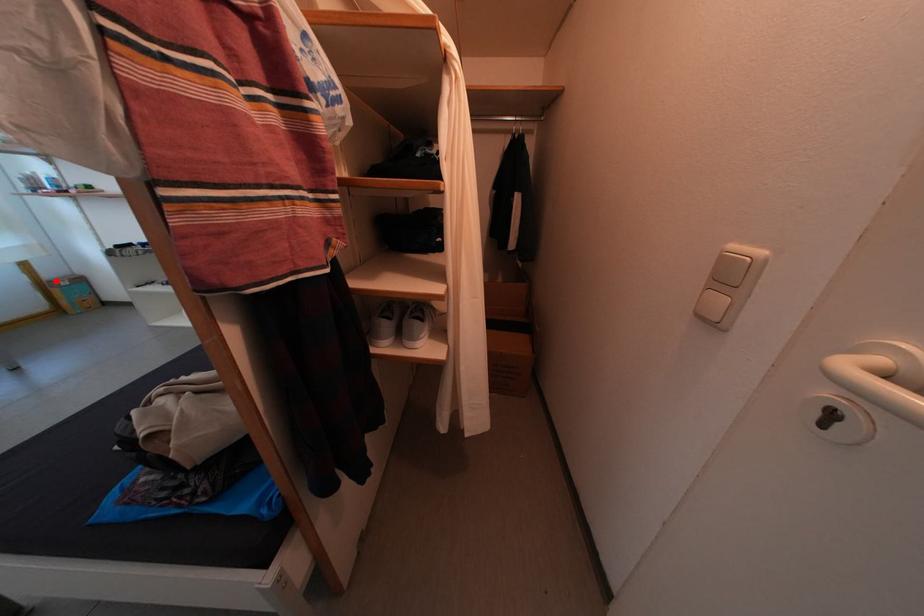
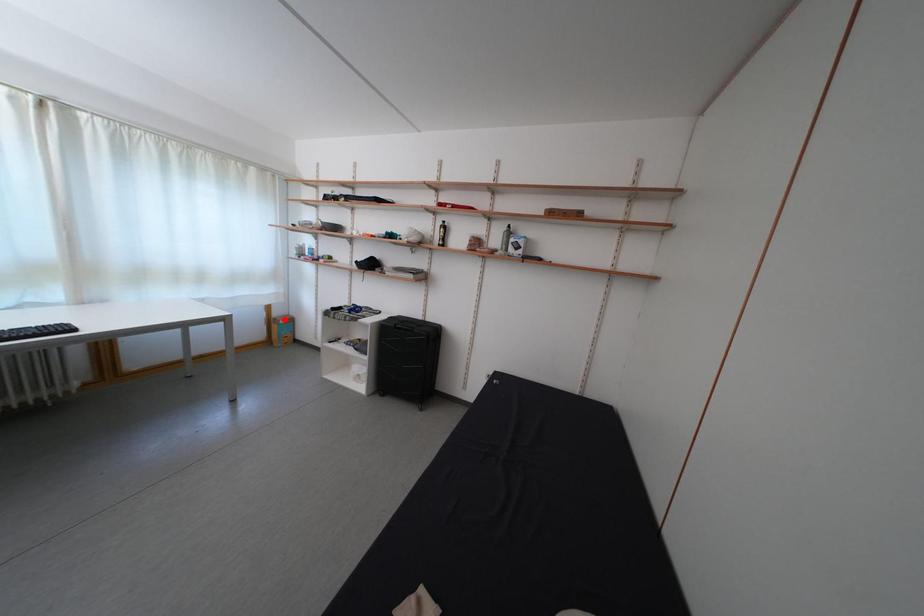
I am providing you with two images of the same scene from different viewpoints. A red point is marked on the first image and another point is marked on the second image. Are the points marked in image1 and image2 representing the same 3D position?

Yes